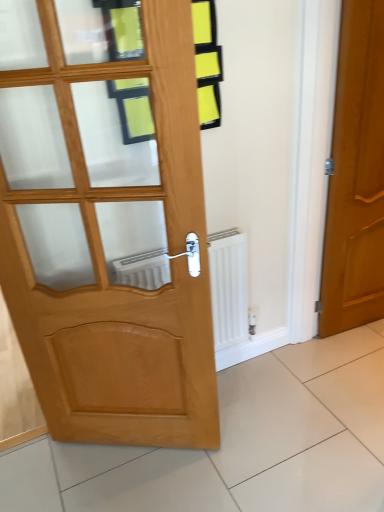
What do you see at coordinates (356, 176) in the screenshot? This screenshot has width=384, height=512. I see `glossy wood door at right, the 1th door from the right` at bounding box center [356, 176].

This screenshot has height=512, width=384. Describe the element at coordinates (107, 229) in the screenshot. I see `light brown wooden door at left, which is counted as the 2th door, starting from the right` at that location.

What are the coordinates of `light brown wooden door at left, which is counted as the 2th door, starting from the right` in the screenshot? It's located at coord(107,229).

Identify the location of white matte radiator at center. (228, 287).

Is point (352, 137) more distant than point (21, 275)?

That is True.

Are glossy wood door at right, the 1th door from the right, and light brown wooden door at left, which is counted as the 2th door, starting from the right, located far from each other?

That's right, there is a large distance between glossy wood door at right, the 1th door from the right, and light brown wooden door at left, which is counted as the 2th door, starting from the right.

From the image's perspective, is glossy wood door at right, the 1th door from the right, located above or below light brown wooden door at left, acting as the first door starting from the left?

From the image's perspective, glossy wood door at right, the 1th door from the right, appears above light brown wooden door at left, acting as the first door starting from the left.

Can you confirm if glossy wood door at right, the 1th door from the right, is positioned to the left of light brown wooden door at left, which is counted as the 2th door, starting from the right?

In fact, glossy wood door at right, the 1th door from the right, is to the right of light brown wooden door at left, which is counted as the 2th door, starting from the right.

Find the location of a particular element. door on the right of the light brown wooden door at left, which is counted as the 2th door, starting from the right is located at coordinates (356, 176).

Between point (146, 431) and point (372, 5), which one is positioned behind?

The point (146, 431) is farther from the camera.

Which object is wider, light brown wooden door at left, which is counted as the 2th door, starting from the right, or glossy wood door at right, the 1th door from the right?

Wider between the two is glossy wood door at right, the 1th door from the right.

How distant is light brown wooden door at left, acting as the first door starting from the left, from glossy wood door at right, which appears as the 2th door when viewed from the left?

light brown wooden door at left, acting as the first door starting from the left, is 1.05 meters from glossy wood door at right, which appears as the 2th door when viewed from the left.

Which object is positioned more to the right, white matte radiator at center or glossy wood door at right, which appears as the 2th door when viewed from the left?

glossy wood door at right, which appears as the 2th door when viewed from the left.

Where is `radiator lying behind the glossy wood door at right, the 1th door from the right`? radiator lying behind the glossy wood door at right, the 1th door from the right is located at coordinates pos(228,287).

From the image's perspective, which one is positioned lower, white matte radiator at center or glossy wood door at right, the 1th door from the right?

white matte radiator at center, from the image's perspective.

Which point is more forward, (235, 277) or (328, 213)?

The point (235, 277) is in front.

Is white matte radiator at center positioned with its back to light brown wooden door at left, acting as the first door starting from the left?

No, white matte radiator at center's orientation is not away from light brown wooden door at left, acting as the first door starting from the left.

Who is smaller, white matte radiator at center or light brown wooden door at left, acting as the first door starting from the left?

With smaller size is white matte radiator at center.

From a real-world perspective, is white matte radiator at center beneath light brown wooden door at left, acting as the first door starting from the left?

Yes, from a real-world perspective, white matte radiator at center is beneath light brown wooden door at left, acting as the first door starting from the left.

Does white matte radiator at center have a greater height compared to light brown wooden door at left, which is counted as the 2th door, starting from the right?

No, white matte radiator at center is not taller than light brown wooden door at left, which is counted as the 2th door, starting from the right.

From a real-world perspective, is light brown wooden door at left, acting as the first door starting from the left, physically above white matte radiator at center?

Correct, in the physical world, light brown wooden door at left, acting as the first door starting from the left, is higher than white matte radiator at center.

From the picture: Which is more to the right, light brown wooden door at left, which is counted as the 2th door, starting from the right, or white matte radiator at center?

white matte radiator at center is more to the right.

Who is taller, light brown wooden door at left, acting as the first door starting from the left, or white matte radiator at center?

light brown wooden door at left, acting as the first door starting from the left, is taller.

Does point (143, 399) lie behind point (222, 276)?

That is False.

From the image's perspective, which one is positioned higher, glossy wood door at right, the 1th door from the right, or white matte radiator at center?

glossy wood door at right, the 1th door from the right.

Could you tell me if glossy wood door at right, which appears as the 2th door when viewed from the left, is facing white matte radiator at center?

No.

Which is more to the right, glossy wood door at right, which appears as the 2th door when viewed from the left, or white matte radiator at center?

glossy wood door at right, which appears as the 2th door when viewed from the left, is more to the right.

I want to click on door above the light brown wooden door at left, acting as the first door starting from the left (from the image's perspective), so click(356, 176).

Find the location of a particular element. door in front of the glossy wood door at right, which appears as the 2th door when viewed from the left is located at coordinates (107, 229).

Estimate the real-world distances between objects in this image. Which object is closer to light brown wooden door at left, acting as the first door starting from the left, white matte radiator at center or glossy wood door at right, which appears as the 2th door when viewed from the left?

white matte radiator at center lies closer to light brown wooden door at left, acting as the first door starting from the left, than the other object.

From the image, which object appears to be nearer to glossy wood door at right, the 1th door from the right, light brown wooden door at left, acting as the first door starting from the left, or white matte radiator at center?

white matte radiator at center is closer to glossy wood door at right, the 1th door from the right.

Which object lies nearer to the anchor point glossy wood door at right, the 1th door from the right, white matte radiator at center or light brown wooden door at left, acting as the first door starting from the left?

white matte radiator at center is closer to glossy wood door at right, the 1th door from the right.

Estimate the real-world distances between objects in this image. Which object is further from light brown wooden door at left, acting as the first door starting from the left, glossy wood door at right, which appears as the 2th door when viewed from the left, or white matte radiator at center?

glossy wood door at right, which appears as the 2th door when viewed from the left, is positioned further to the anchor light brown wooden door at left, acting as the first door starting from the left.

Based on their spatial positions, is light brown wooden door at left, acting as the first door starting from the left, or glossy wood door at right, the 1th door from the right, closer to white matte radiator at center?

light brown wooden door at left, acting as the first door starting from the left, is positioned closer to the anchor white matte radiator at center.

Looking at this image, based on their spatial positions, is glossy wood door at right, the 1th door from the right, or light brown wooden door at left, which is counted as the 2th door, starting from the right, closer to white matte radiator at center?

light brown wooden door at left, which is counted as the 2th door, starting from the right.

You are a GUI agent. You are given a task and a screenshot of the screen. Output one action in this format:
    pyautogui.click(x=<x>, y=<y>)
    Task: Click on the radiator between light brown wooden door at left, which is counted as the 2th door, starting from the right, and glossy wood door at right, the 1th door from the right
    This screenshot has width=384, height=512.
    Given the screenshot: What is the action you would take?
    pyautogui.click(x=228, y=287)